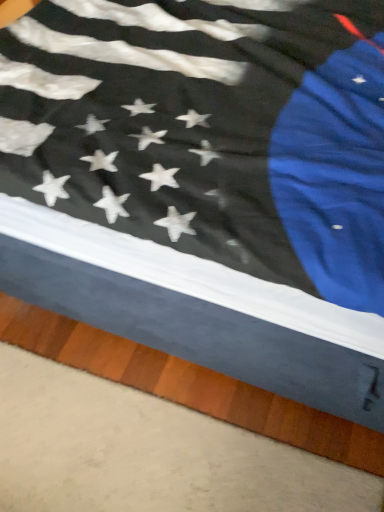
The width and height of the screenshot is (384, 512). What are the coordinates of `black matte flag at center` in the screenshot? It's located at (209, 131).

Image resolution: width=384 pixels, height=512 pixels. Describe the element at coordinates (209, 131) in the screenshot. I see `black matte flag at center` at that location.

In order to face smooth wood plank at lower right, should I rotate leftwards or rightwards?

Rotate left and turn 6.994 degrees.

The height and width of the screenshot is (512, 384). Identify the location of smooth wood plank at lower right. (189, 385).

The width and height of the screenshot is (384, 512). What do you see at coordinates (189, 385) in the screenshot?
I see `smooth wood plank at lower right` at bounding box center [189, 385].

This screenshot has width=384, height=512. I want to click on black matte flag at center, so click(x=209, y=131).

Is black matte flag at center at the right side of smooth wood plank at lower right?

Yes, black matte flag at center is to the right of smooth wood plank at lower right.

Is black matte flag at center closer to camera compared to smooth wood plank at lower right?

Yes.

Considering the positions of points (8, 167) and (54, 326), is point (8, 167) closer to camera compared to point (54, 326)?

Yes, point (8, 167) is in front of point (54, 326).

From the image's perspective, is black matte flag at center under smooth wood plank at lower right?

No.

From a real-world perspective, which object stands above the other?

black matte flag at center, from a real-world perspective.

Is black matte flag at center wider or thinner than smooth wood plank at lower right?

In the image, black matte flag at center appears to be wider than smooth wood plank at lower right.

Considering the sizes of objects black matte flag at center and smooth wood plank at lower right in the image provided, who is shorter, black matte flag at center or smooth wood plank at lower right?

Standing shorter between the two is smooth wood plank at lower right.

Considering the relative sizes of black matte flag at center and smooth wood plank at lower right in the image provided, is black matte flag at center bigger than smooth wood plank at lower right?

Correct, black matte flag at center is larger in size than smooth wood plank at lower right.

Would you say smooth wood plank at lower right is part of black matte flag at center's contents?

No, smooth wood plank at lower right is not surrounded by black matte flag at center.

Is black matte flag at center not close to smooth wood plank at lower right?

No, there isn't a large distance between black matte flag at center and smooth wood plank at lower right.

Based on the photo, is black matte flag at center oriented towards smooth wood plank at lower right?

No, black matte flag at center is not turned towards smooth wood plank at lower right.

How different are the orientations of black matte flag at center and smooth wood plank at lower right in degrees?

black matte flag at center and smooth wood plank at lower right are facing 88.5 degrees away from each other.

Where is `flag that appears above the smooth wood plank at lower right (from the image's perspective)`? Image resolution: width=384 pixels, height=512 pixels. flag that appears above the smooth wood plank at lower right (from the image's perspective) is located at coordinates (209, 131).

Which is more to the right, smooth wood plank at lower right or black matte flag at center?

black matte flag at center.

In the image, is smooth wood plank at lower right positioned in front of or behind black matte flag at center?

Clearly, smooth wood plank at lower right is behind black matte flag at center.

Is point (331, 423) positioned in front of point (380, 89)?

That is False.

From the image's perspective, which object appears higher, smooth wood plank at lower right or black matte flag at center?

black matte flag at center appears higher in the image.

From a real-world perspective, which is physically above, smooth wood plank at lower right or black matte flag at center?

black matte flag at center, from a real-world perspective.

Can you confirm if smooth wood plank at lower right is wider than black matte flag at center?

No.

Who is shorter, smooth wood plank at lower right or black matte flag at center?

Standing shorter between the two is smooth wood plank at lower right.

Which of these two, smooth wood plank at lower right or black matte flag at center, is bigger?

black matte flag at center.

Would you say smooth wood plank at lower right is outside black matte flag at center?

Yes, smooth wood plank at lower right is outside of black matte flag at center.

Is smooth wood plank at lower right with black matte flag at center?

No, smooth wood plank at lower right is not in contact with black matte flag at center.

Is smooth wood plank at lower right turned away from black matte flag at center?

No, smooth wood plank at lower right is not facing away from black matte flag at center.

You are a GUI agent. You are given a task and a screenshot of the screen. Output one action in this format:
    pyautogui.click(x=<x>, y=<y>)
    Task: Click on the flag on the right of smooth wood plank at lower right
    
    Given the screenshot: What is the action you would take?
    pyautogui.click(x=209, y=131)

This screenshot has height=512, width=384. In order to click on flag above the smooth wood plank at lower right (from the image's perspective) in this screenshot , I will do `click(209, 131)`.

In order to click on flag in front of the smooth wood plank at lower right in this screenshot , I will do `click(209, 131)`.